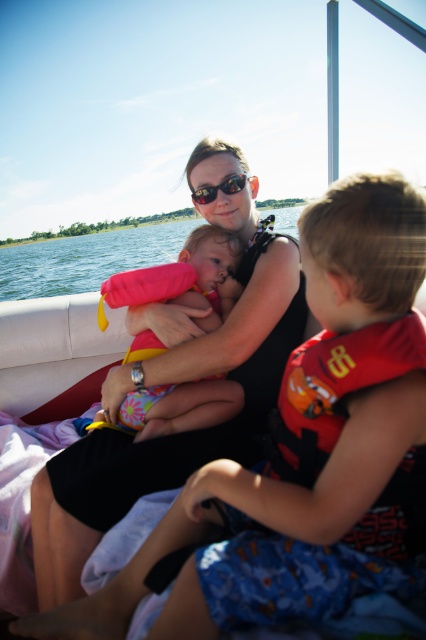
You are on a boat and need to secure a life jacket. Looking at the scene, where is the red fabric life jacket at center in relation to the clear blue water at center?

The red fabric life jacket at center is to the right of the clear blue water at center.

You are a safety inspector checking life preservers on a boat. You see the red fabric life jacket at center and the pink fabric life vest at center. Which one is shorter in height?

The red fabric life jacket at center is shorter than the pink fabric life vest at center.